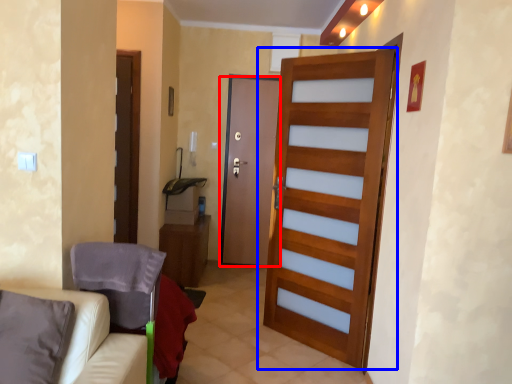
Question: Which point is closer to the camera, door (highlighted by a red box) or door (highlighted by a blue box)?

Choices:
 (A) door
 (B) door

Answer: (B)